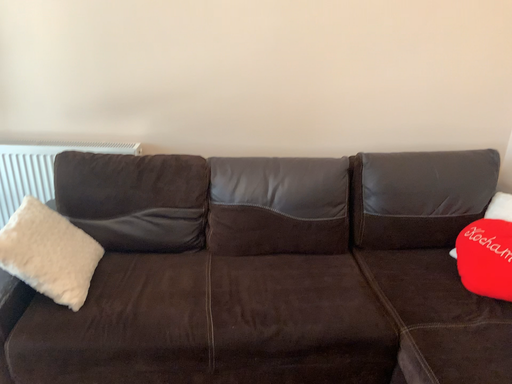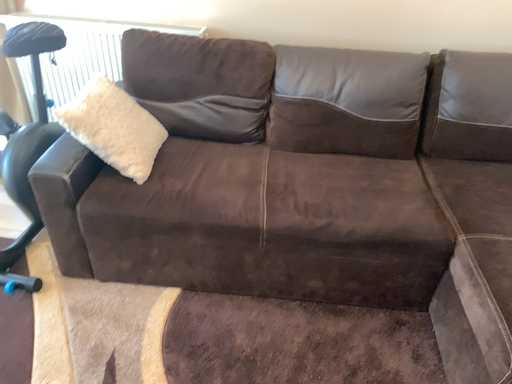
Question: How did the camera likely rotate when shooting the video?

Choices:
 (A) rotated downward
 (B) rotated upward

Answer: (A)